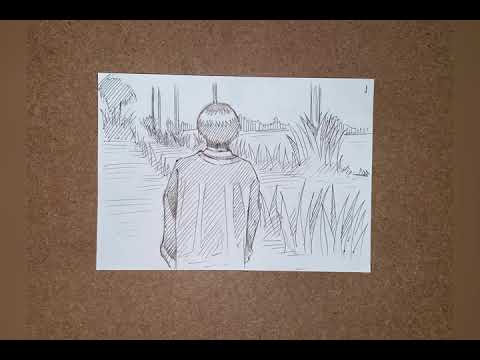
Locate an element on the screen. board is located at coordinates (304, 333).